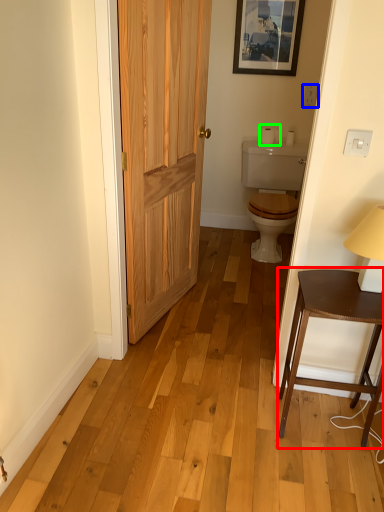
Question: Based on their relative distances, which object is farther from table (highlighted by a red box)? Choose from electric outlet (highlighted by a blue box) and toilet paper (highlighted by a green box).

Choices:
 (A) electric outlet
 (B) toilet paper

Answer: (A)